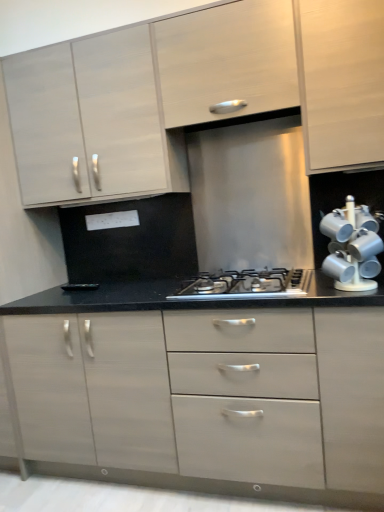
Question: Considering the positions of white glossy mug rack at right and matte white cabinet at upper left, which appears as the second cabinetry when viewed from the top, in the image, is white glossy mug rack at right taller or shorter than matte white cabinet at upper left, which appears as the second cabinetry when viewed from the top,?

Choices:
 (A) tall
 (B) short

Answer: (B)

Question: Is point (349, 200) positioned closer to the camera than point (64, 90)?

Choices:
 (A) farther
 (B) closer

Answer: (B)

Question: Based on their relative distances, which object is farther from the matte white drawer at center, the first cabinetry from the bottom?

Choices:
 (A) satin silver gas stove at center
 (B) matte white cabinet at upper left, which appears as the second cabinetry when viewed from the top
 (C) white glossy mug rack at right
 (D) matte white cabinet at upper center, which is the 1th cabinetry from top to bottom

Answer: (D)

Question: Which is nearer to the white glossy mug rack at right?

Choices:
 (A) matte white drawer at center, the 3th cabinetry from the top
 (B) matte white cabinet at upper center, which is the 1th cabinetry from top to bottom
 (C) matte white cabinet at upper left, which appears as the second cabinetry when viewed from the top
 (D) satin silver gas stove at center

Answer: (D)